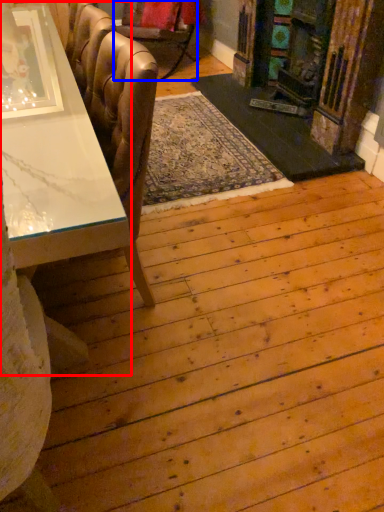
Question: Among these objects, which one is farthest to the camera, table (highlighted by a red box) or chair (highlighted by a blue box)?

Choices:
 (A) table
 (B) chair

Answer: (B)